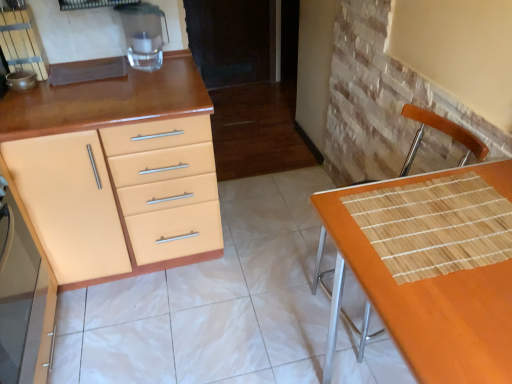
Question: Is transparent glass water at upper left at the back of matte orange cabinet at left, the 1th cabinetry from the back?

Choices:
 (A) yes
 (B) no

Answer: (B)

Question: Is matte orange cabinet at left, the 1th cabinetry from the back, facing towards transparent glass water at upper left?

Choices:
 (A) yes
 (B) no

Answer: (B)

Question: Is matte orange cabinet at left, the 1th cabinetry from the back, to the left of transparent glass water at upper left from the viewer's perspective?

Choices:
 (A) yes
 (B) no

Answer: (A)

Question: From a real-world perspective, is matte orange cabinet at left, the 1th cabinetry from the back, physically above transparent glass water at upper left?

Choices:
 (A) no
 (B) yes

Answer: (A)

Question: Does matte orange cabinet at left, acting as the second cabinetry starting from the front, have a greater width compared to transparent glass water at upper left?

Choices:
 (A) yes
 (B) no

Answer: (A)

Question: From the image's perspective, is matte orange cabinet at left, acting as the second cabinetry starting from the front, on transparent glass water at upper left?

Choices:
 (A) yes
 (B) no

Answer: (B)

Question: Is matte beige cabinet at left, the first cabinetry viewed from the front, directly adjacent to transparent glass water at upper left?

Choices:
 (A) no
 (B) yes

Answer: (A)

Question: Considering the relative sizes of matte beige cabinet at left, the 2th cabinetry from the back, and transparent glass water at upper left in the image provided, is matte beige cabinet at left, the 2th cabinetry from the back, bigger than transparent glass water at upper left?

Choices:
 (A) yes
 (B) no

Answer: (A)

Question: From the image's perspective, is matte beige cabinet at left, the 2th cabinetry from the back, located above transparent glass water at upper left?

Choices:
 (A) no
 (B) yes

Answer: (A)

Question: Is matte beige cabinet at left, the 2th cabinetry from the back, at the left side of transparent glass water at upper left?

Choices:
 (A) yes
 (B) no

Answer: (A)

Question: Considering the relative positions of matte beige cabinet at left, the 2th cabinetry from the back, and transparent glass water at upper left in the image provided, is matte beige cabinet at left, the 2th cabinetry from the back, to the right of transparent glass water at upper left from the viewer's perspective?

Choices:
 (A) yes
 (B) no

Answer: (B)

Question: Are matte beige cabinet at left, the 2th cabinetry from the back, and transparent glass water at upper left far apart?

Choices:
 (A) yes
 (B) no

Answer: (B)

Question: From a real-world perspective, is matte beige cabinet at left, the first cabinetry viewed from the front, beneath matte orange cabinet at left, acting as the second cabinetry starting from the front?

Choices:
 (A) yes
 (B) no

Answer: (B)